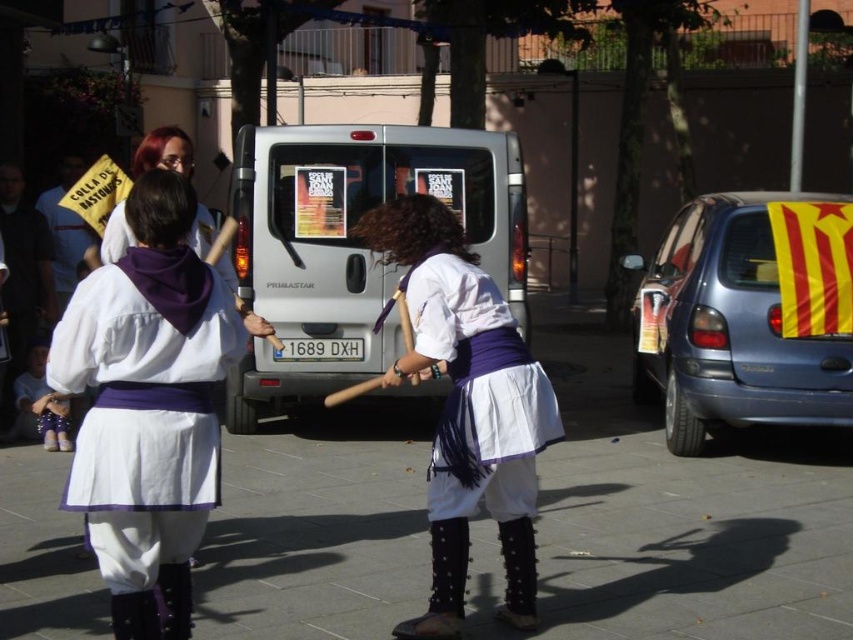
Question: Does white smooth pavement at center have a lesser width compared to white cotton skirt at center?

Choices:
 (A) no
 (B) yes

Answer: (B)

Question: Is white smooth pavement at center bigger than white cotton shirt at center?

Choices:
 (A) no
 (B) yes

Answer: (A)

Question: Considering the real-world distances, which object is closest to the matte white blouse at center?

Choices:
 (A) blue metallic hatchback at right
 (B) white cotton dress at center
 (C) silver metallic van at center
 (D) white cotton shirt at center

Answer: (B)

Question: Which point appears farthest from the camera in this image?

Choices:
 (A) (462, 365)
 (B) (744, 422)
 (C) (294, 176)
 (D) (73, 211)

Answer: (C)

Question: Estimate the real-world distances between objects in this image. Which object is closer to the white cotton shirt at center?

Choices:
 (A) matte white blouse at center
 (B) white cotton dress at center
 (C) silver metallic van at center
 (D) white smooth pavement at center

Answer: (C)

Question: Where is white smooth pavement at center located in relation to white cotton shirt at center in the image?

Choices:
 (A) left
 (B) right

Answer: (B)